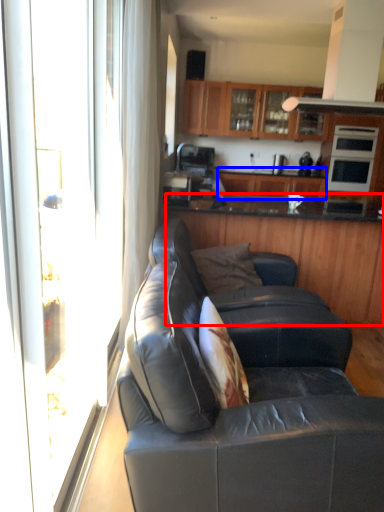
Question: Which object is closer to the camera taking this photo, cabinetry (highlighted by a red box) or cabinetry (highlighted by a blue box)?

Choices:
 (A) cabinetry
 (B) cabinetry

Answer: (A)